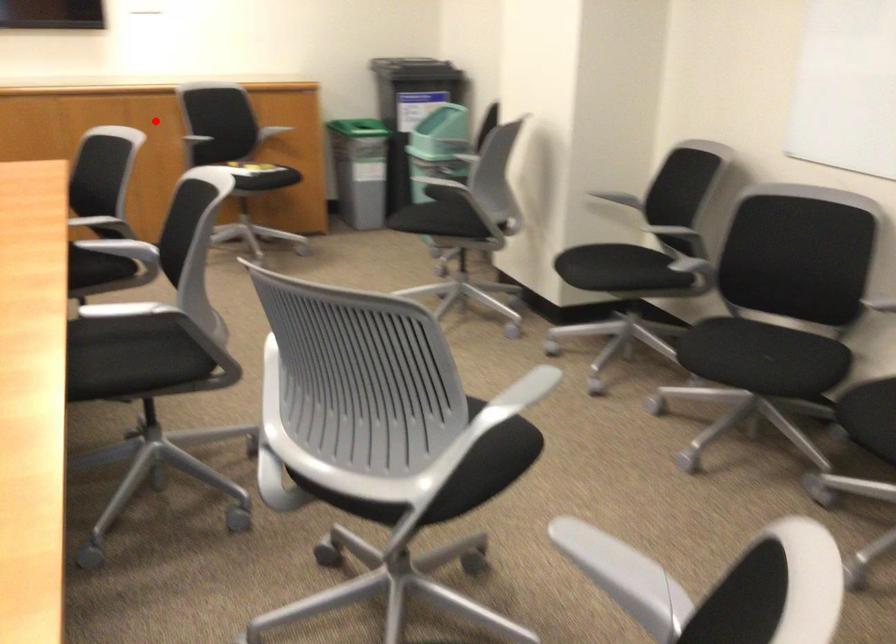
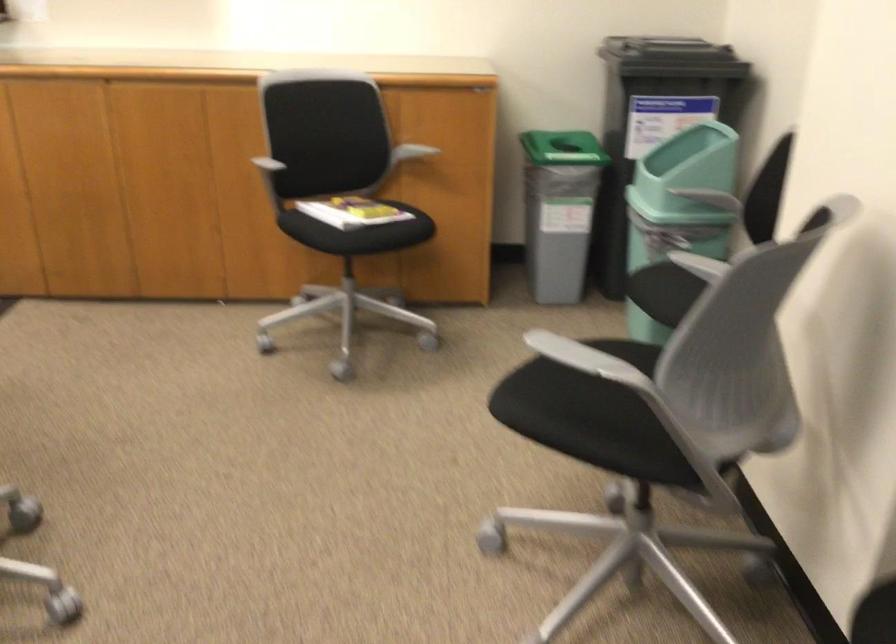
Question: I am providing you with two images of the same scene from different viewpoints. A red point is shown in image1. For the corresponding object point in image2, is it positioned nearer or farther from the camera?

Choices:
 (A) Nearer
 (B) Farther

Answer: (A)